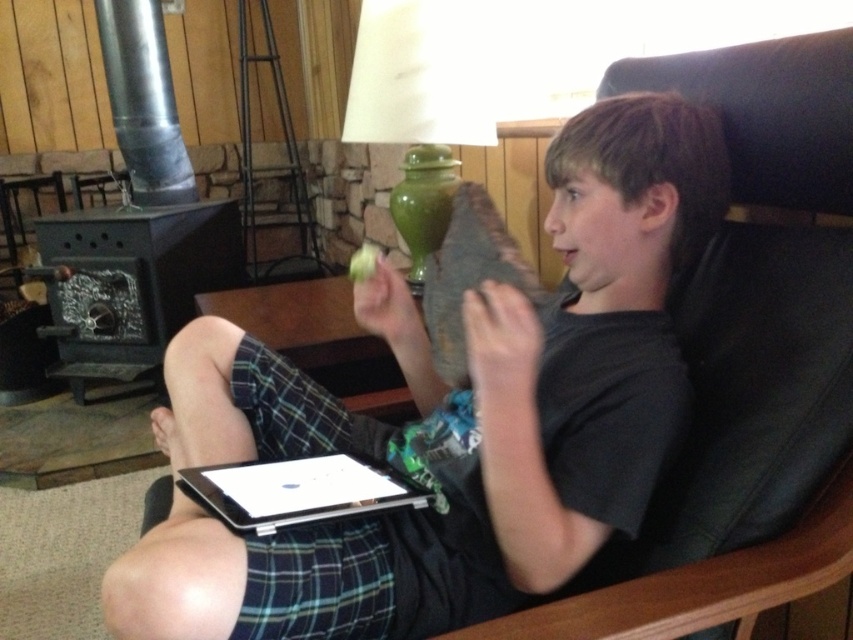
Imagine you are taking a photo of the living room scene. You notice two points marked in the image at coordinates point (442, 612) and point (268, 470). Which point should you focus on to ensure it appears clearer in the photo?

Point (442, 612) is closer to the camera than point (268, 470), so focusing on point (442, 612) will make it appear clearer in the photo.

The black matte shirt at center is located at which coordinate point?

The black matte shirt at center is located at point (453, 419).